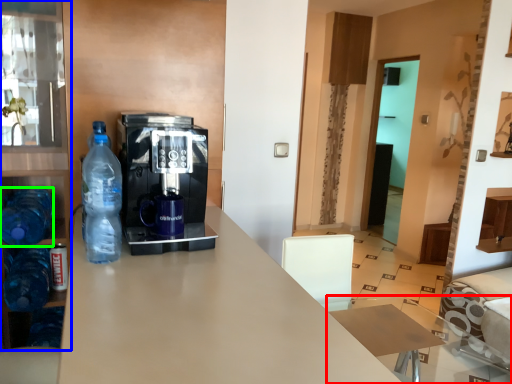
Question: Based on their relative distances, which object is farther from table (highlighted by a red box)? Choose from cabinetry (highlighted by a blue box) and bottle (highlighted by a green box).

Choices:
 (A) cabinetry
 (B) bottle

Answer: (A)